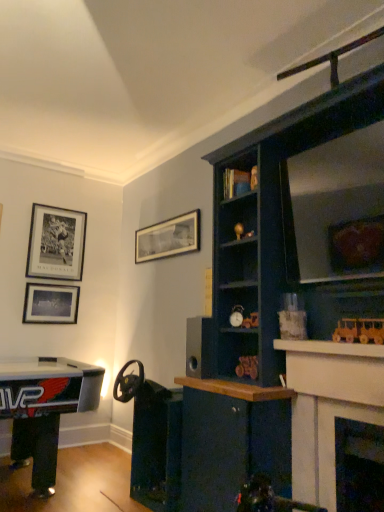
At what (x,y) coordinates should I click in order to perform the action: click on gold metallic ball at upper center, which is the fourth toy from bottom to top. Please return your answer as a coordinate pair (x, y). This screenshot has width=384, height=512. Looking at the image, I should click on (239, 231).

What is the approximate height of matte black picture frame at upper left, which ranks as the 2th picture frame in left-to-right order?

matte black picture frame at upper left, which ranks as the 2th picture frame in left-to-right order, is 27.46 inches in height.

I want to click on matte black picture frame at upper center, the 3th picture frame when ordered from left to right, so (x=168, y=238).

Between white glossy fireplace at upper right, which is counted as the 2th fireplace, starting from the right, and matte black fireplace at lower right, which is counted as the second fireplace, starting from the left, which one appears on the left side from the viewer's perspective?

From the viewer's perspective, white glossy fireplace at upper right, which is counted as the 2th fireplace, starting from the right, appears more on the left side.

Find the location of a particular element. fireplace located above the matte black fireplace at lower right, which is counted as the second fireplace, starting from the left (from a real-world perspective) is located at coordinates (328, 407).

From a real-world perspective, which is physically above, white glossy fireplace at upper right, acting as the 1th fireplace starting from the left, or matte black fireplace at lower right, which is counted as the second fireplace, starting from the left?

white glossy fireplace at upper right, acting as the 1th fireplace starting from the left, from a real-world perspective.

Looking at this image, considering the sizes of white glossy fireplace at upper right, acting as the 1th fireplace starting from the left, and matte black fireplace at lower right, which is counted as the second fireplace, starting from the left, in the image, is white glossy fireplace at upper right, acting as the 1th fireplace starting from the left, wider or thinner than matte black fireplace at lower right, which is counted as the second fireplace, starting from the left,?

Considering their sizes, white glossy fireplace at upper right, acting as the 1th fireplace starting from the left, looks slimmer than matte black fireplace at lower right, which is counted as the second fireplace, starting from the left.

Is point (380, 410) positioned in front of point (374, 321)?

Yes, it is.

Consider the image. Considering the sizes of objects matte black fireplace at lower right, which is counted as the second fireplace, starting from the left, and wooden train at right, the fifth toy when ordered from left to right, in the image provided, who is wider, matte black fireplace at lower right, which is counted as the second fireplace, starting from the left, or wooden train at right, the fifth toy when ordered from left to right,?

matte black fireplace at lower right, which is counted as the second fireplace, starting from the left, is wider.

From a real-world perspective, does matte black fireplace at lower right, which is counted as the second fireplace, starting from the left, sit lower than wooden train at right, the 5th toy from the back?

Correct, in the physical world, matte black fireplace at lower right, which is counted as the second fireplace, starting from the left, is lower than wooden train at right, the 5th toy from the back.

Are matte black fireplace at lower right, which ranks as the 1th fireplace in right-to-left order, and wooden train at right, the fifth toy when ordered from left to right, located far from each other?

No, matte black fireplace at lower right, which ranks as the 1th fireplace in right-to-left order, is in close proximity to wooden train at right, the fifth toy when ordered from left to right.

Locate an element on the screen. This screenshot has width=384, height=512. picture frame that is the 1st one when counting leftward from the matte black alarm clock at center, arranged as the second toy when viewed from the back is located at coordinates (168, 238).

Which object is positioned more to the left, matte black picture frame at upper center, the 3th picture frame when ordered from left to right, or matte black alarm clock at center, the 4th toy positioned from the front?

From the viewer's perspective, matte black picture frame at upper center, the 3th picture frame when ordered from left to right, appears more on the left side.

Which is correct: matte black picture frame at upper center, the 3th picture frame when ordered from left to right, is inside matte black alarm clock at center, the fifth toy when ordered from right to left, or outside of it?

matte black picture frame at upper center, the 3th picture frame when ordered from left to right, exists outside the volume of matte black alarm clock at center, the fifth toy when ordered from right to left.

How much distance is there between matte black picture frame at upper center, which ranks as the first picture frame in right-to-left order, and matte black alarm clock at center, the 4th toy positioned from the front?

A distance of 3.93 feet exists between matte black picture frame at upper center, which ranks as the first picture frame in right-to-left order, and matte black alarm clock at center, the 4th toy positioned from the front.

Image resolution: width=384 pixels, height=512 pixels. In order to click on toy that is the 2nd object above the matte black fireplace at lower right, which ranks as the 1th fireplace in right-to-left order (from a real-world perspective) in this screenshot , I will do `click(359, 331)`.

How different are the orientations of wooden train at right, the 5th toy from the back, and matte black fireplace at lower right, which is counted as the second fireplace, starting from the left, in degrees?

The angular difference between wooden train at right, the 5th toy from the back, and matte black fireplace at lower right, which is counted as the second fireplace, starting from the left, is 0.00203 degrees.

Which of these two, wooden train at right, which is the 1th toy in front-to-back order, or matte black fireplace at lower right, which is counted as the second fireplace, starting from the left, stands taller?

With more height is matte black fireplace at lower right, which is counted as the second fireplace, starting from the left.

Is matte black picture frame at upper left, positioned as the 1th picture frame in left-to-right order, turned away from matte black picture frame at upper left, acting as the 2th picture frame starting from the right?

matte black picture frame at upper left, positioned as the 1th picture frame in left-to-right order, does not have its back to matte black picture frame at upper left, acting as the 2th picture frame starting from the right.

Can you confirm if matte black picture frame at upper left, positioned as the 1th picture frame in left-to-right order, is taller than matte black picture frame at upper left, which ranks as the 2th picture frame in left-to-right order?

No.

Is matte black picture frame at upper left, marked as the third picture frame in a right-to-left arrangement, placed right next to matte black picture frame at upper left, which ranks as the 2th picture frame in left-to-right order?

matte black picture frame at upper left, marked as the third picture frame in a right-to-left arrangement, and matte black picture frame at upper left, which ranks as the 2th picture frame in left-to-right order, are not in contact.

Based on the photo, considering the relative sizes of matte black picture frame at upper left, marked as the third picture frame in a right-to-left arrangement, and matte black picture frame at upper left, acting as the 2th picture frame starting from the right, in the image provided, is matte black picture frame at upper left, marked as the third picture frame in a right-to-left arrangement, bigger than matte black picture frame at upper left, acting as the 2th picture frame starting from the right,?

No, matte black picture frame at upper left, marked as the third picture frame in a right-to-left arrangement, is not bigger than matte black picture frame at upper left, acting as the 2th picture frame starting from the right.

In the scene shown: Can you confirm if gold metallic ball at upper center, acting as the 2th toy starting from the left, is wider than metallic gold toy car at center-right, the fourth toy from the back?

No.

Do you think gold metallic ball at upper center, acting as the 2th toy starting from the left, is within metallic gold toy car at center-right, the first toy from the bottom, or outside of it?

gold metallic ball at upper center, acting as the 2th toy starting from the left, exists outside the volume of metallic gold toy car at center-right, the first toy from the bottom.

Does gold metallic ball at upper center, arranged as the 1th toy when viewed from the back, have a smaller size compared to metallic gold toy car at center-right, the first toy from the bottom?

Yes.

From a real-world perspective, which is physically above, gold metallic ball at upper center, which is the fourth toy in right-to-left order, or metallic gold toy car at center-right, the fifth toy when ordered from top to bottom?

From a 3D spatial view, gold metallic ball at upper center, which is the fourth toy in right-to-left order, is above.

Is black matte speaker at center bigger or smaller than metallic gold toy car at center-right, the fourth toy from the back?

black matte speaker at center is bigger than metallic gold toy car at center-right, the fourth toy from the back.

From a real-world perspective, relative to metallic gold toy car at center-right, the fifth toy when ordered from top to bottom, is black matte speaker at center vertically above or below?

From a real-world perspective, black matte speaker at center is physically above metallic gold toy car at center-right, the fifth toy when ordered from top to bottom.

What's the angular difference between black matte speaker at center and metallic gold toy car at center-right, the first toy from the bottom,'s facing directions?

1.83 degrees separate the facing orientations of black matte speaker at center and metallic gold toy car at center-right, the first toy from the bottom.

Is black matte speaker at center spatially inside metallic gold toy car at center-right, which appears as the 3th toy when viewed from the right, or outside of it?

black matte speaker at center lies outside metallic gold toy car at center-right, which appears as the 3th toy when viewed from the right.

Locate an element on the screen. The height and width of the screenshot is (512, 384). fireplace that is below the white glossy fireplace at upper right, which is counted as the 2th fireplace, starting from the right (from the image's perspective) is located at coordinates (334, 441).

Which toy is the 1st one when counting from the left side of the matte black fireplace at lower right, which is counted as the second fireplace, starting from the left? Please provide its 2D coordinates.

[(359, 331)]

From the image, which object appears to be nearer to matte black picture frame at upper left, which ranks as the 2th picture frame in left-to-right order, wooden figurine at upper center, the 5th toy in the bottom-to-top sequence, or white glossy fireplace at upper right, acting as the 1th fireplace starting from the left?

wooden figurine at upper center, the 5th toy in the bottom-to-top sequence, lies closer to matte black picture frame at upper left, which ranks as the 2th picture frame in left-to-right order, than the other object.

Based on their spatial positions, is matte black alarm clock at center, the 4th toy when ordered from top to bottom, or gold metallic ball at upper center, which is the fourth toy from bottom to top, closer to matte black picture frame at upper left, acting as the 2th picture frame starting from the right?

Among the two, gold metallic ball at upper center, which is the fourth toy from bottom to top, is located nearer to matte black picture frame at upper left, acting as the 2th picture frame starting from the right.

Estimate the real-world distances between objects in this image. Which object is closer to matte black alarm clock at center, the 4th toy when ordered from top to bottom, matte black picture frame at upper center, which ranks as the first picture frame in right-to-left order, or gold metallic ball at upper center, which is the fourth toy from bottom to top?

gold metallic ball at upper center, which is the fourth toy from bottom to top.

Considering their positions, is wooden train at right, marked as the 1th toy in a right-to-left arrangement, positioned closer to matte black picture frame at upper left, which ranks as the 2th picture frame in left-to-right order, than matte black alarm clock at center, which is counted as the first toy, starting from the left?

The object closer to matte black picture frame at upper left, which ranks as the 2th picture frame in left-to-right order, is matte black alarm clock at center, which is counted as the first toy, starting from the left.

When comparing their distances from wooden figurine at upper center, which ranks as the 3th toy in back-to-front order, does matte black picture frame at upper center, the 3th picture frame when ordered from left to right, or matte black picture frame at upper left, acting as the 2th picture frame starting from the right, seem further?

The object further to wooden figurine at upper center, which ranks as the 3th toy in back-to-front order, is matte black picture frame at upper left, acting as the 2th picture frame starting from the right.

Based on their spatial positions, is matte black fireplace at lower right, which is counted as the second fireplace, starting from the left, or white glossy fireplace at upper right, acting as the 1th fireplace starting from the left, closer to matte black alarm clock at center, acting as the 2th toy starting from the bottom?

white glossy fireplace at upper right, acting as the 1th fireplace starting from the left.

Estimate the real-world distances between objects in this image. Which object is closer to matte black fireplace at lower right, which ranks as the 1th fireplace in right-to-left order, matte black picture frame at upper left, positioned as the 1th picture frame in left-to-right order, or wooden train at right, the 5th toy from the back?

wooden train at right, the 5th toy from the back, lies closer to matte black fireplace at lower right, which ranks as the 1th fireplace in right-to-left order, than the other object.

Estimate the real-world distances between objects in this image. Which object is closer to white glossy fireplace at upper right, acting as the 1th fireplace starting from the left, wooden figurine at upper center, the 5th toy in the bottom-to-top sequence, or gold metallic ball at upper center, arranged as the 1th toy when viewed from the back?

gold metallic ball at upper center, arranged as the 1th toy when viewed from the back, is positioned closer to the anchor white glossy fireplace at upper right, acting as the 1th fireplace starting from the left.

In order to click on fireplace positioned between white glossy fireplace at upper right, acting as the 1th fireplace starting from the left, and black matte speaker at center from near to far in this screenshot , I will do `click(334, 441)`.

Locate an element on the screen. picture frame between matte black picture frame at upper left, positioned as the 1th picture frame in left-to-right order, and matte black picture frame at upper center, which ranks as the first picture frame in right-to-left order, from left to right is located at coordinates (56, 243).

Find the location of a particular element. Image resolution: width=384 pixels, height=512 pixels. speaker between metallic gold toy car at center-right, the fifth toy when ordered from top to bottom, and matte black picture frame at upper center, which ranks as the first picture frame in right-to-left order, along the z-axis is located at coordinates (199, 347).

Where is `toy positioned between matte black alarm clock at center, the 4th toy when ordered from top to bottom, and matte black picture frame at upper center, which ranks as the first picture frame in right-to-left order, from near to far`? The width and height of the screenshot is (384, 512). toy positioned between matte black alarm clock at center, the 4th toy when ordered from top to bottom, and matte black picture frame at upper center, which ranks as the first picture frame in right-to-left order, from near to far is located at coordinates (239, 231).